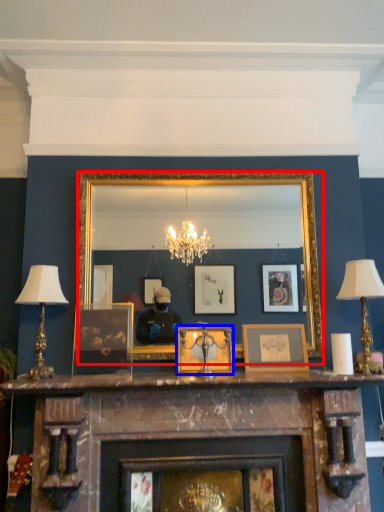
Question: Which point is further to the camera, mirror (highlighted by a red box) or picture frame (highlighted by a blue box)?

Choices:
 (A) mirror
 (B) picture frame

Answer: (A)